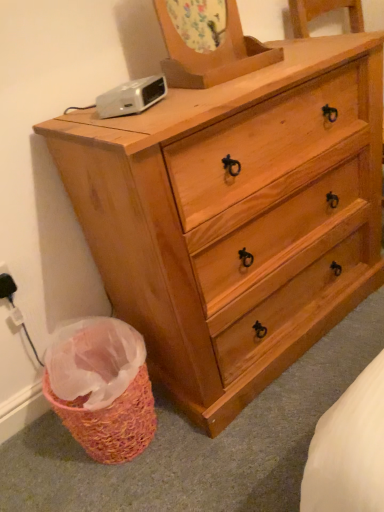
You are a GUI agent. You are given a task and a screenshot of the screen. Output one action in this format:
    pyautogui.click(x=<x>, y=<y>)
    Task: Click on the spots to the right of white plastic clock at upper left
    The height and width of the screenshot is (512, 384).
    Given the screenshot: What is the action you would take?
    pyautogui.click(x=198, y=94)